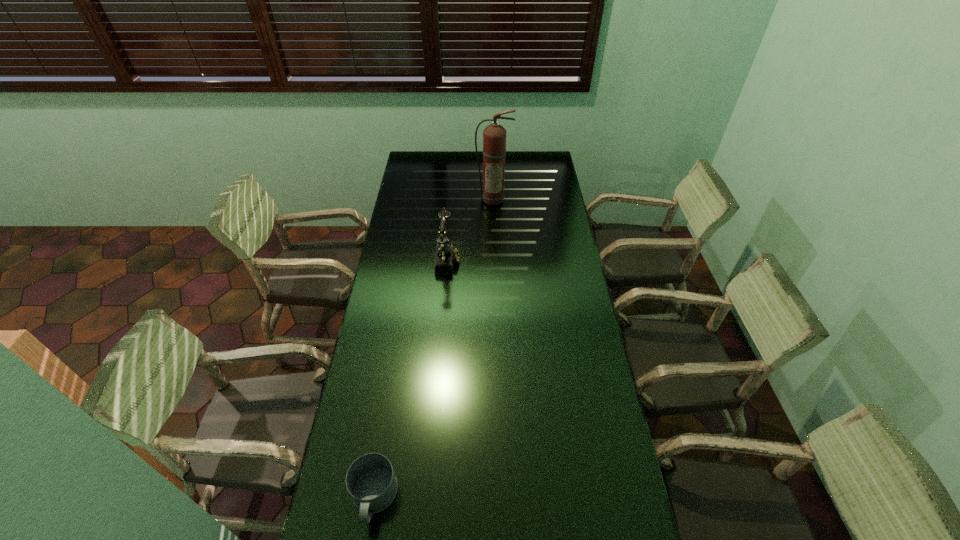
What are the coordinates of `vacant space at the left edge` in the screenshot? It's located at (416, 188).

This screenshot has width=960, height=540. I want to click on free space at the right edge of the desktop, so click(571, 420).

This screenshot has width=960, height=540. I want to click on free area in between the telephone and the shortest object, so click(411, 379).

At what (x,y) coordinates should I click in order to perform the action: click on free space between the telephone and the nearest object. Please return your answer as a coordinate pair (x, y). Looking at the image, I should click on (411, 379).

The height and width of the screenshot is (540, 960). I want to click on vacant point located between the second nearest object and the rightmost object, so click(x=470, y=229).

This screenshot has height=540, width=960. What are the coordinates of `free space between the fire extinguisher and the shortest object` in the screenshot? It's located at tap(434, 349).

Where is `free space between the mug and the farthest object`? The image size is (960, 540). free space between the mug and the farthest object is located at coordinates (434, 349).

Locate which object ranks in proximity to the nearest object. Please provide its 2D coordinates. Your answer should be formatted as a tuple, i.e. [(x, y)], where the tuple contains the x and y coordinates of a point satisfying the conditions above.

[(446, 254)]

Select which object is the closest to the telephone. Please provide its 2D coordinates. Your answer should be formatted as a tuple, i.e. [(x, y)], where the tuple contains the x and y coordinates of a point satisfying the conditions above.

[(494, 135)]

Locate an element on the screen. The width and height of the screenshot is (960, 540). free region that satisfies the following two spatial constraints: 1. on the side of the fire extinguisher with the label and nozzle; 2. on the dial of the telephone is located at coordinates (495, 259).